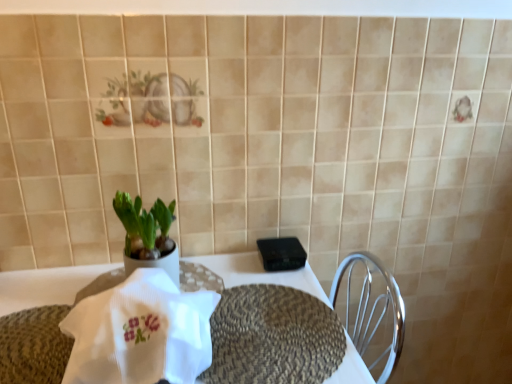
The width and height of the screenshot is (512, 384). Find the location of `empty space that is ontop of white woven placemat at center (from a real-world perspective)`. empty space that is ontop of white woven placemat at center (from a real-world perspective) is located at coordinates (184, 286).